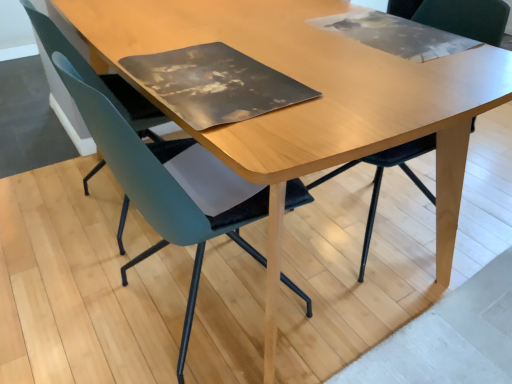
Question: Does teal fabric chair at center, arranged as the second chair when viewed from the right, appear on the right side of light wood table at center?

Choices:
 (A) yes
 (B) no

Answer: (B)

Question: From a real-world perspective, is teal fabric chair at center, arranged as the second chair when viewed from the right, on top of light wood table at center?

Choices:
 (A) no
 (B) yes

Answer: (B)

Question: Considering the relative positions of teal fabric chair at center, arranged as the second chair when viewed from the right, and light wood table at center in the image provided, is teal fabric chair at center, arranged as the second chair when viewed from the right, behind light wood table at center?

Choices:
 (A) yes
 (B) no

Answer: (A)

Question: Is there a large distance between teal fabric chair at center, the second chair in the left-to-right sequence, and light wood table at center?

Choices:
 (A) yes
 (B) no

Answer: (B)

Question: Is teal fabric chair at center, the second chair in the left-to-right sequence, touching light wood table at center?

Choices:
 (A) no
 (B) yes

Answer: (A)

Question: In terms of width, does teal matte chair at left, the third chair viewed from the right, look wider or thinner when compared to teal fabric chair at center, the second chair in the left-to-right sequence?

Choices:
 (A) thin
 (B) wide

Answer: (A)

Question: In the image, is teal matte chair at left, the 1th chair in the left-to-right sequence, positioned in front of or behind teal fabric chair at center, the second chair in the left-to-right sequence?

Choices:
 (A) behind
 (B) front

Answer: (A)

Question: From the image's perspective, is teal matte chair at left, the 1th chair in the left-to-right sequence, positioned above or below teal fabric chair at center, arranged as the second chair when viewed from the right?

Choices:
 (A) below
 (B) above

Answer: (B)

Question: From a real-world perspective, is teal matte chair at left, the 1th chair in the left-to-right sequence, physically located above or below teal fabric chair at center, arranged as the second chair when viewed from the right?

Choices:
 (A) below
 (B) above

Answer: (A)

Question: From a real-world perspective, is teal fabric chair at center, the second chair in the left-to-right sequence, positioned above or below teal matte chair at left, the 1th chair in the left-to-right sequence?

Choices:
 (A) above
 (B) below

Answer: (A)

Question: Based on their positions, is teal fabric chair at center, the second chair in the left-to-right sequence, located to the left or right of teal matte chair at left, the 1th chair in the left-to-right sequence?

Choices:
 (A) right
 (B) left

Answer: (A)

Question: Is point (234, 213) positioned closer to the camera than point (110, 89)?

Choices:
 (A) closer
 (B) farther

Answer: (A)

Question: Based on their sizes in the image, would you say teal fabric chair at center, the second chair in the left-to-right sequence, is bigger or smaller than teal matte chair at left, the third chair viewed from the right?

Choices:
 (A) small
 (B) big

Answer: (B)

Question: From a real-world perspective, is teal matte chair at left, the third chair viewed from the right, positioned above or below light wood table at center?

Choices:
 (A) above
 (B) below

Answer: (A)

Question: From their relative heights in the image, would you say teal matte chair at left, the third chair viewed from the right, is taller or shorter than light wood table at center?

Choices:
 (A) short
 (B) tall

Answer: (B)